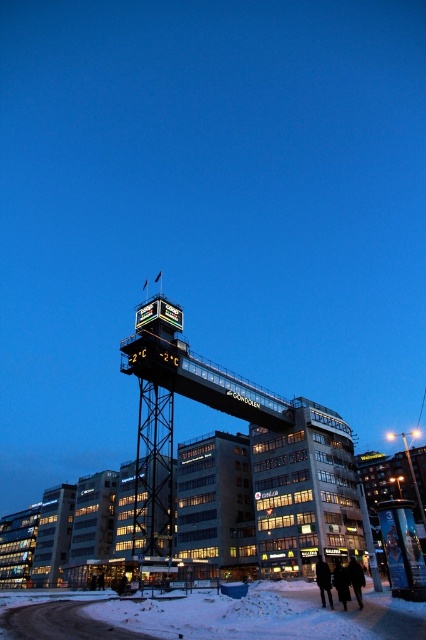
Please describe the position of the black wool coat at lower center in terms of coordinates within the image frame. The image frame is divided into a grid from 0 to 1 along both the x and y axes. The origin is at the bottom left corner of the image. The scene is an urban area with a tall tower and buildings.

The black wool coat at lower center is located at coordinates approximately 0.908 on the x axis and 0.761 on the y axis within the image frame.

You are standing in the urban scene shown in the image. You see a white powdery snow at lower center and a black wool coat at lower center. Which object is wider?

The white powdery snow at lower center is wider than the black wool coat at lower center.

You are standing at the base of the tower structure in the image. You want to walk to the nearest building with illuminated windows. Which direction should you head relative to the white powdery snow at lower center?

The white powdery snow at lower center is located at point (230,618). Since the nearest buildings with illuminated windows are below the tower structure, you should head downward from the white powdery snow at lower center to reach them.